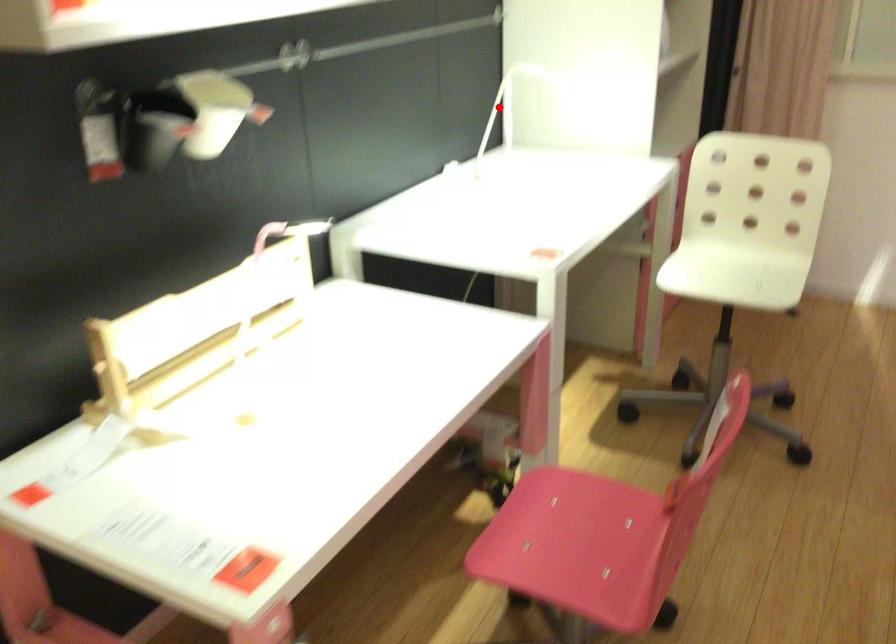
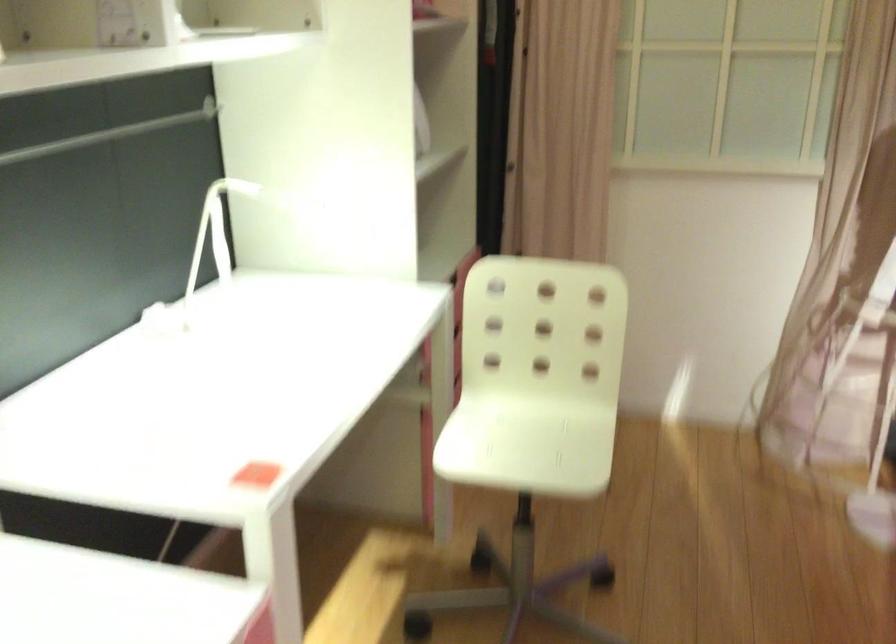
Find the pixel in the second image that matches the highlighted location in the first image.

(213, 234)